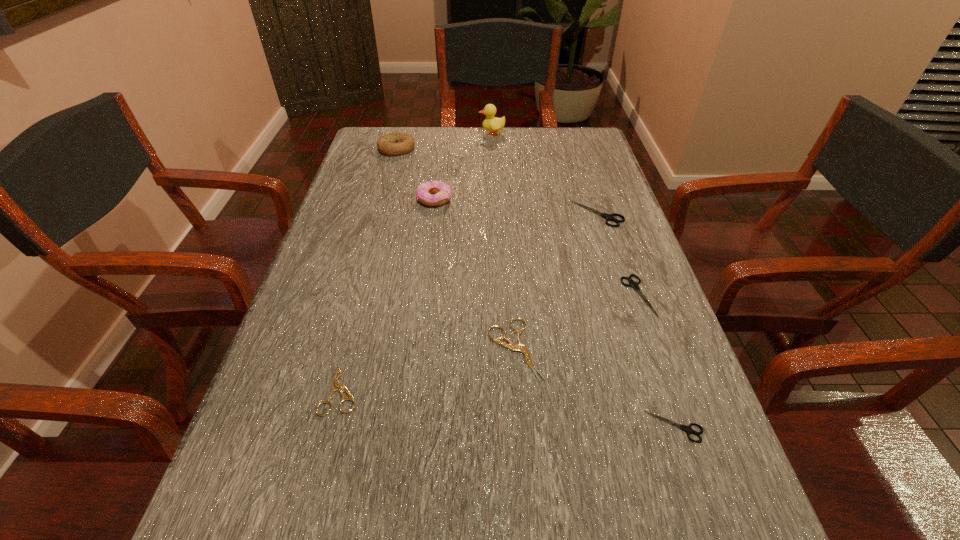
This screenshot has height=540, width=960. I want to click on the right beige shears, so click(x=521, y=347).

Identify the location of the bigger beige shears. This screenshot has width=960, height=540. (521, 347).

Where is `the left beige shears`? The height and width of the screenshot is (540, 960). the left beige shears is located at coordinates (336, 385).

You are a GUI agent. You are given a task and a screenshot of the screen. Output one action in this format:
    pyautogui.click(x=<x>, y=<y>)
    Task: Click on the smaller beige shears
    This screenshot has height=540, width=960.
    Given the screenshot: What is the action you would take?
    pyautogui.click(x=336, y=385)

This screenshot has width=960, height=540. I want to click on the nearest black shears, so click(688, 429).

This screenshot has width=960, height=540. In order to click on vacant space located on the front-facing side of the duckling in this screenshot , I will do `click(451, 133)`.

Identify the location of vacant space located 0.080m on the front-facing side of the duckling. The height and width of the screenshot is (540, 960). (454, 133).

Where is `free region located on the front-facing side of the duckling`? The width and height of the screenshot is (960, 540). free region located on the front-facing side of the duckling is located at coordinates (448, 133).

Locate an element on the screen. Image resolution: width=960 pixels, height=540 pixels. free space located 0.350m on the right of the seventh nearest object is located at coordinates (527, 148).

Where is `free location located on the right of the third object from left to right`? The image size is (960, 540). free location located on the right of the third object from left to right is located at coordinates (474, 199).